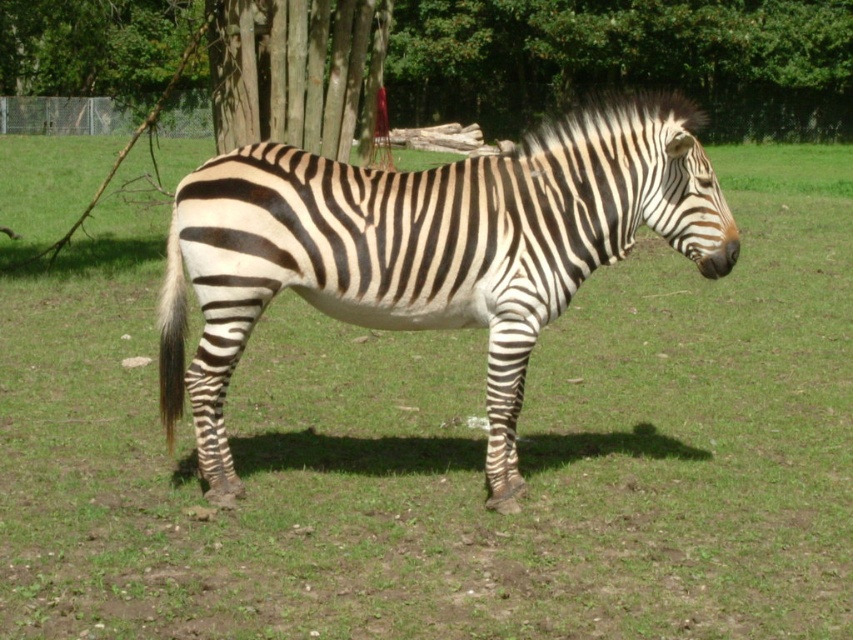
Does black and white striped zebra at center appear over rough bark tree at upper center?

No.

The height and width of the screenshot is (640, 853). I want to click on black and white striped zebra at center, so click(x=428, y=250).

Is point (579, 282) positioned behind point (405, 115)?

No.

Who is more forward, (328, 212) or (149, 28)?

Point (328, 212)

Locate an element on the screen. Image resolution: width=853 pixels, height=640 pixels. black and white striped zebra at center is located at coordinates (428, 250).

Is green leafy tree at upper center to the right of rough bark tree at upper center from the viewer's perspective?

Correct, you'll find green leafy tree at upper center to the right of rough bark tree at upper center.

Is point (515, 33) positioned behind point (335, 68)?

Yes, point (515, 33) is behind point (335, 68).

Locate an element on the screen. This screenshot has width=853, height=640. green leafy tree at upper center is located at coordinates (625, 60).